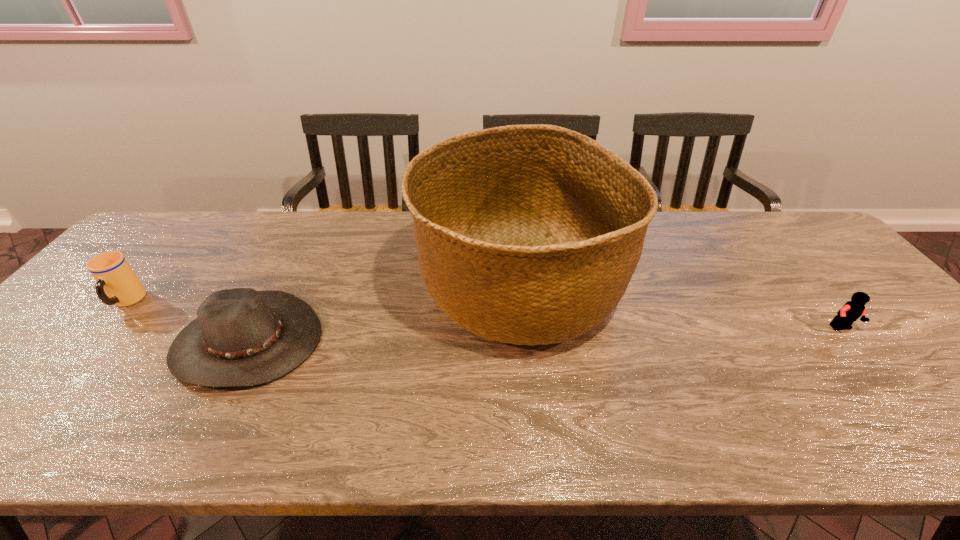
In order to click on basket in this screenshot , I will do `click(529, 234)`.

Image resolution: width=960 pixels, height=540 pixels. What are the coordinates of `the tallest object` in the screenshot? It's located at pyautogui.click(x=529, y=234).

You are a GUI agent. You are given a task and a screenshot of the screen. Output one action in this format:
    pyautogui.click(x=<x>, y=<y>)
    Task: Click on the cup
    
    Given the screenshot: What is the action you would take?
    [117, 284]

Locate an element on the screen. The image size is (960, 540). hat is located at coordinates (242, 337).

In order to click on Lego in this screenshot , I will do `click(851, 311)`.

Identify the location of free spot located 0.150m on the left of the tallest object. This screenshot has height=540, width=960. (361, 287).

At what (x,y) coordinates should I click in order to perform the action: click on free spot located on the side of the leftmost object with the handle. Please return your answer as a coordinate pair (x, y). The image size is (960, 540). Looking at the image, I should click on (19, 427).

Locate an element on the screen. vacant space positioned 0.050m on the front-facing side of the hat is located at coordinates (210, 415).

You are a GUI agent. You are given a task and a screenshot of the screen. Output one action in this format:
    pyautogui.click(x=<x>, y=<y>)
    Task: Click on the free space located on the front-facing side of the Lego
    The height and width of the screenshot is (540, 960).
    Given the screenshot: What is the action you would take?
    pyautogui.click(x=935, y=441)

The width and height of the screenshot is (960, 540). What are the coordinates of `object situated at the far edge` in the screenshot? It's located at (529, 234).